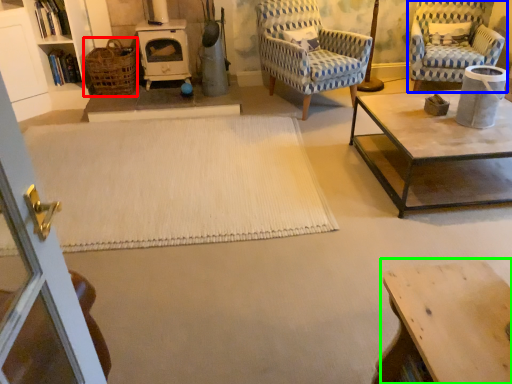
Question: Estimate the real-world distances between objects in this image. Which object is farther from basket (highlighted by a red box), chair (highlighted by a blue box) or table (highlighted by a green box)?

Choices:
 (A) chair
 (B) table

Answer: (B)